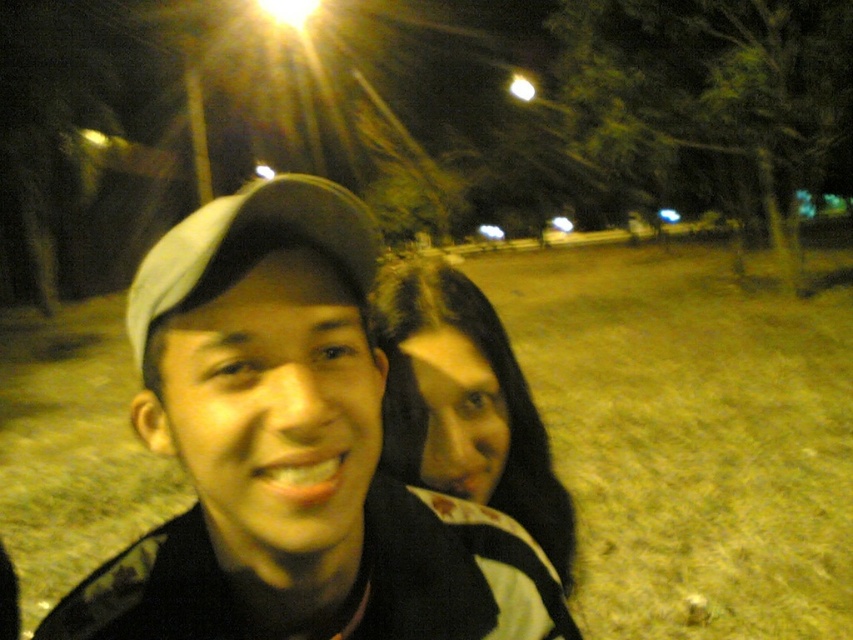
You are a photographer trying to capture a closeup shot of the matte black cap at center and the dark brown hair at center. Which object will appear larger in your photo?

The matte black cap at center will appear larger in the photo because it is closer to the viewer than the dark brown hair at center.

You are a photographer trying to capture the scene. You notice the matte black cap at center and the dark brown hair at center. Which object is positioned higher in the image?

The matte black cap at center is above dark brown hair at center, so the matte black cap at center is positioned higher in the image.